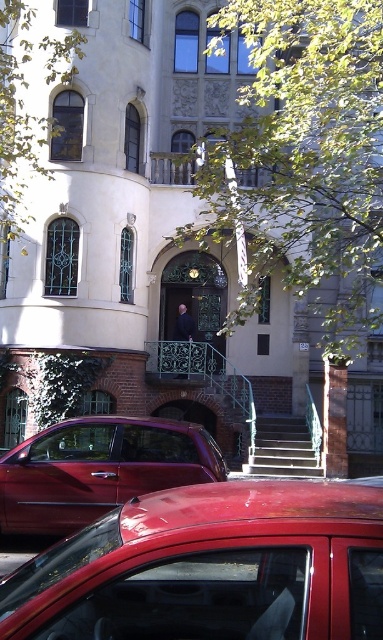
You are a pedestrian standing at the entrance of the building. You see a shiny red car at lower center and a smooth black suit at center. Which object is closer to you?

The shiny red car at lower center is closer to you because it is in front of the smooth black suit at center.

Looking at this image, you are a delivery person who needs to park your shiny metallic car at lower left near the entrance of the building. However, there is a metallic gray stairs at center blocking the path. Can your car pass under the stairs without hitting the stairs?

The shiny metallic car at lower left is much taller than the metallic gray stairs at center. Therefore, the car cannot pass under the stairs without hitting them because the car is taller than the stairs.

You are standing at the entrance of the building and see the shiny red car at lower center and the metallic gray stairs at center. Which object is positioned to the left when facing the building?

The shiny red car at lower center is positioned to the left of the metallic gray stairs at center when facing the building.